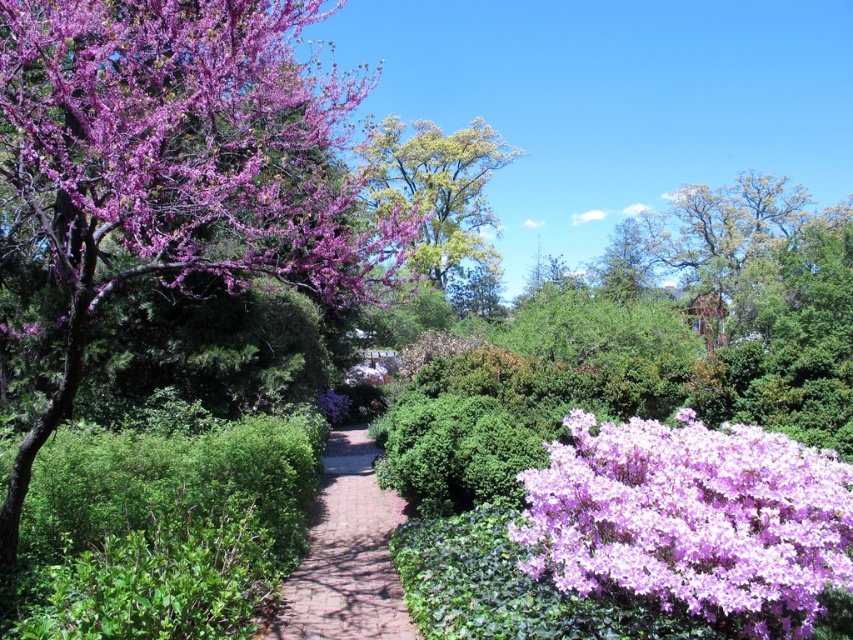
You are planning to place a large statue in the garden. The statue requires a space as big as the purple matte tree at upper left. Is there enough space near the brick paved path at center?

The purple matte tree at upper left is bigger than the brick paved path at center. Therefore, the space near the brick paved path at center may not be sufficient to accommodate a statue requiring the size of the purple matte tree at upper left.

You are standing in the garden and want to walk along the brick paved path at center. Which direction should you look to see the green leafy tree at center?

The brick paved path at center is below the green leafy tree at center, so you should look upward to see the green leafy tree at center while walking along the brick paved path at center.

You are planning to take a photo of the purple matte tree at upper left and the brick paved path at center. Based on their sizes, which object will occupy more space in your camera frame?

The purple matte tree at upper left will occupy more space in the camera frame because its width is larger than the brick paved path at center.